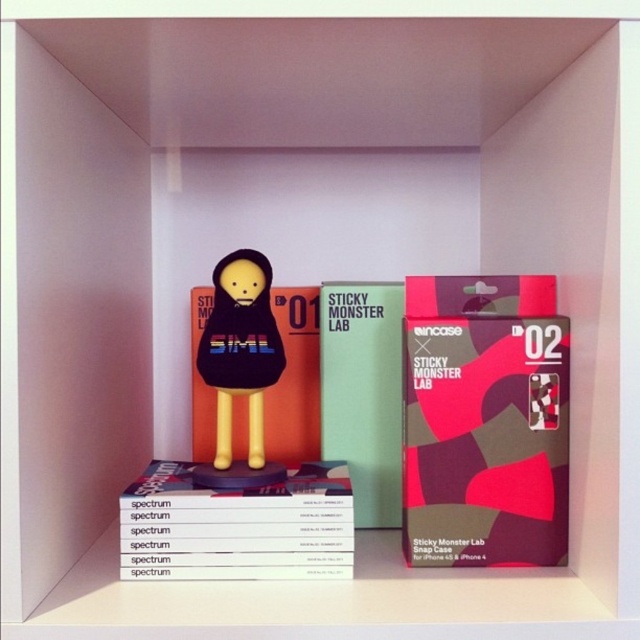
Question: Estimate the real-world distances between objects in this image. Which object is closer to the pink matte book at center?

Choices:
 (A) matte black figure at center
 (B) green matte book at center
 (C) white paper book at center

Answer: (B)

Question: Estimate the real-world distances between objects in this image. Which object is farther from the pink matte book at center?

Choices:
 (A) matte pink box at center
 (B) white paper book at center

Answer: (B)

Question: Can you confirm if matte pink box at center is positioned above white paper book at center?

Choices:
 (A) no
 (B) yes

Answer: (B)

Question: Which point is closer to the camera?

Choices:
 (A) matte black figure at center
 (B) white paper book at center
 (C) pink matte book at center

Answer: (B)

Question: Is matte pink box at center wider than matte black figure at center?

Choices:
 (A) no
 (B) yes

Answer: (B)

Question: Is green matte book at center positioned at the back of matte black figure at center?

Choices:
 (A) no
 (B) yes

Answer: (B)